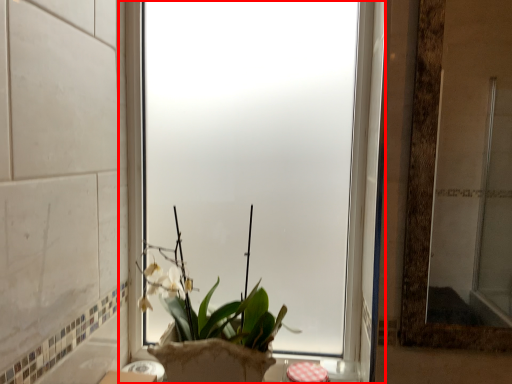
Question: From the image's perspective, what is the correct spatial positioning of window (annotated by the red box) in reference to houseplant?

Choices:
 (A) below
 (B) above

Answer: (B)